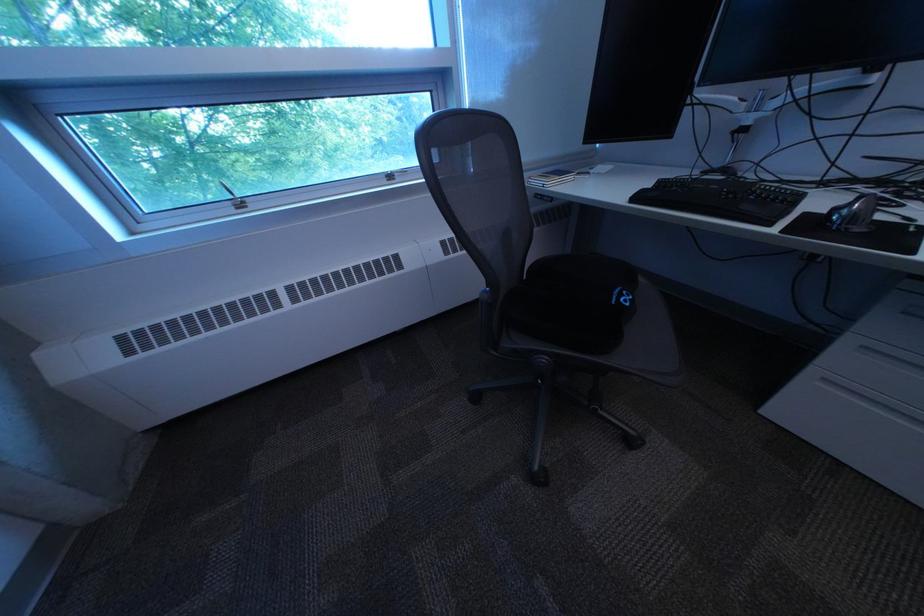
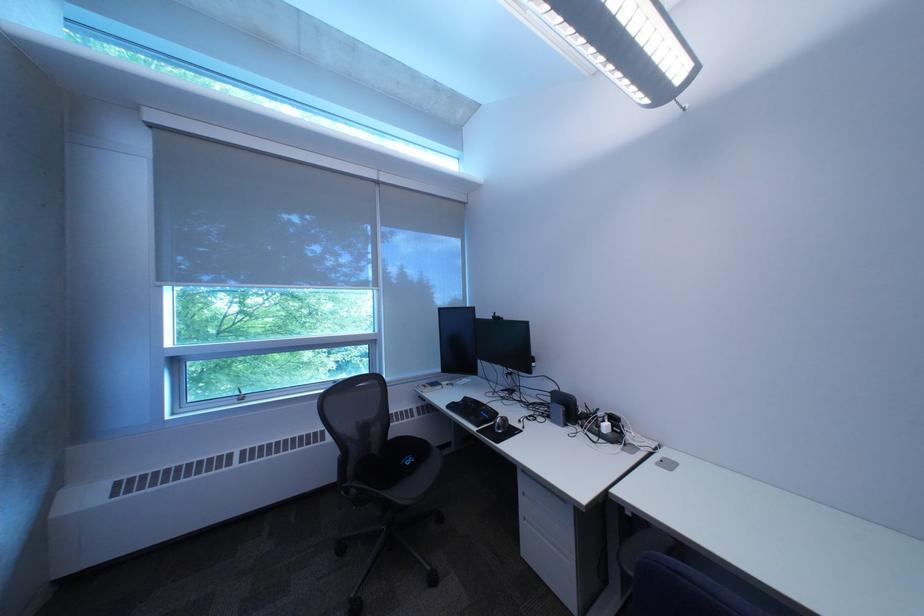
Locate, in the second image, the point that corresponds to [637,296] in the first image.

(423, 461)